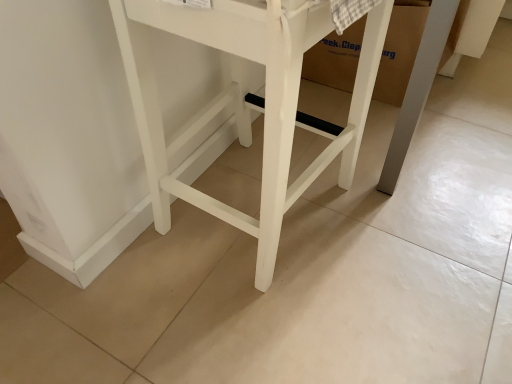
You are a GUI agent. You are given a task and a screenshot of the screen. Output one action in this format:
    pyautogui.click(x=<x>, y=<y>)
    Task: Click on the white matte stool at center
    
    Given the screenshot: What is the action you would take?
    pyautogui.click(x=246, y=101)

This screenshot has width=512, height=384. What do you see at coordinates (246, 101) in the screenshot?
I see `white matte stool at center` at bounding box center [246, 101].

Find the location of a particular element. white matte stool at center is located at coordinates (246, 101).